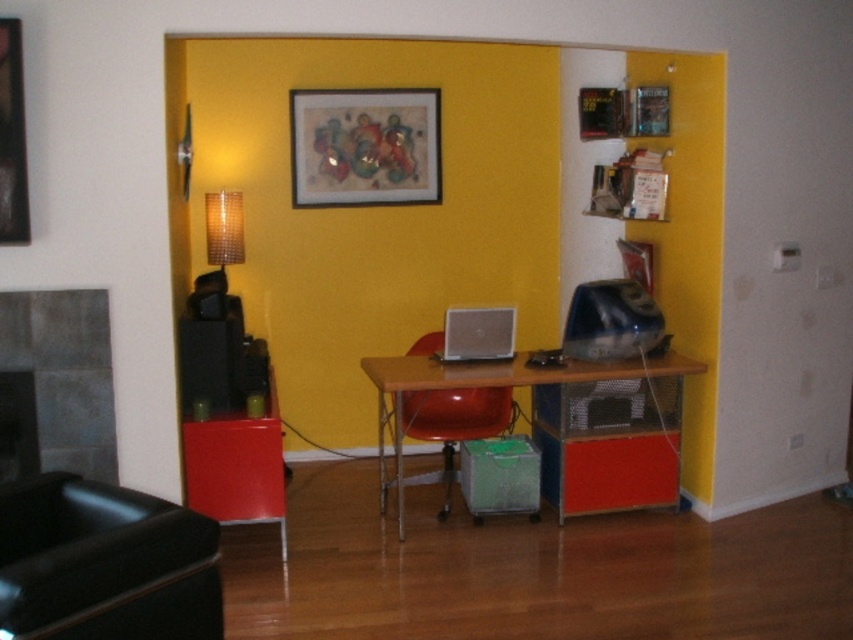
You are sitting in the matte black swivel chair at lower left and want to reach the remote control placed on the mantel of the gray stone fireplace at left. Can you easily reach it while staying seated?

The matte black swivel chair at lower left is positioned under the gray stone fireplace at left, so yes, you can easily reach the remote control on the mantel since the chair is directly underneath the fireplace.

You are sitting in the matte red chair at center and want to reach the gray stone fireplace at left to adjust the thermostat. Is the fireplace directly to your left side?

The gray stone fireplace at left is to the left of matte red chair at center, so yes, the fireplace is directly to your left side.

You are sitting in the matte red chair at center and want to place a decorative item on the gray stone fireplace at left. Is the fireplace above or below your current position?

The gray stone fireplace at left is above the matte red chair at center, so the fireplace is positioned higher than your current seating location.